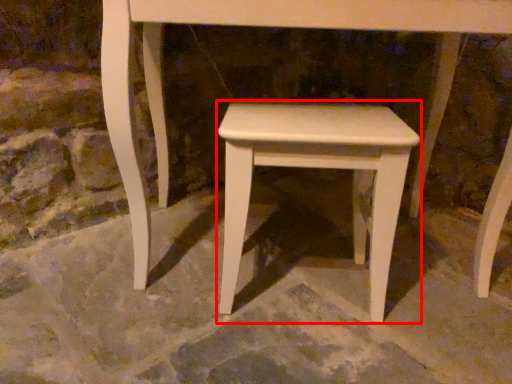
Question: From the image's perspective, considering the relative positions of stool (annotated by the red box) and concrete in the image provided, where is stool (annotated by the red box) located with respect to the staircase?

Choices:
 (A) above
 (B) below

Answer: (A)